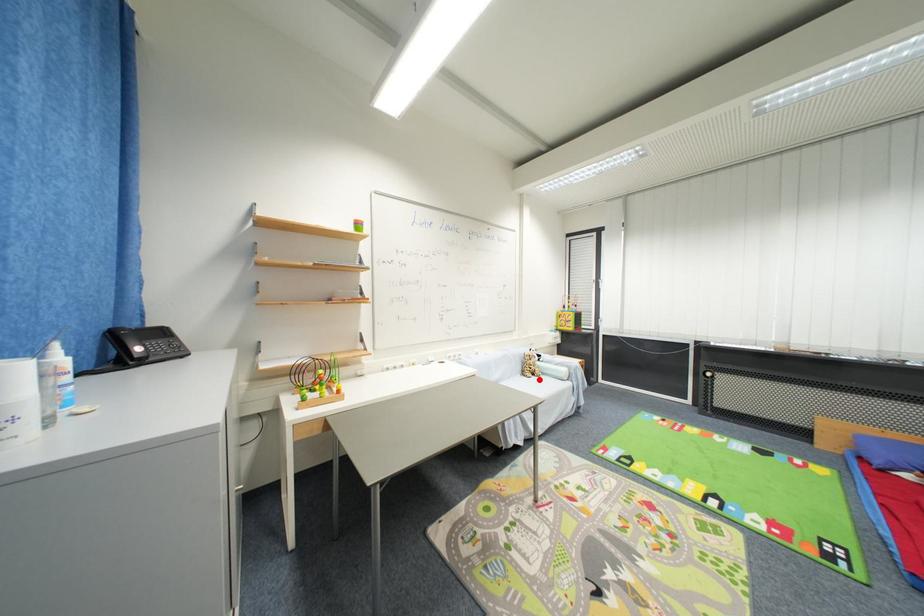
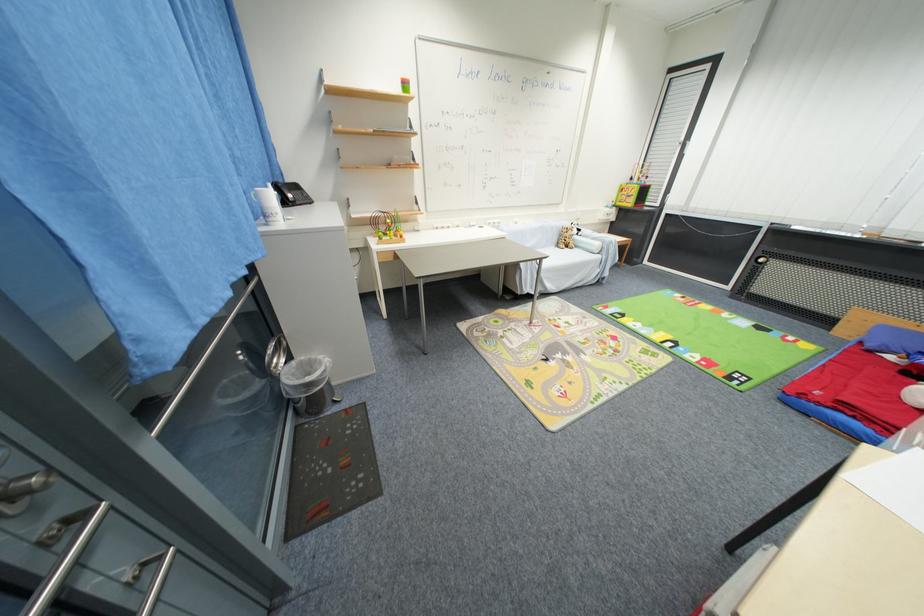
Where in the second image is the point corresponding to the highlighted location from the first image?

(572, 251)